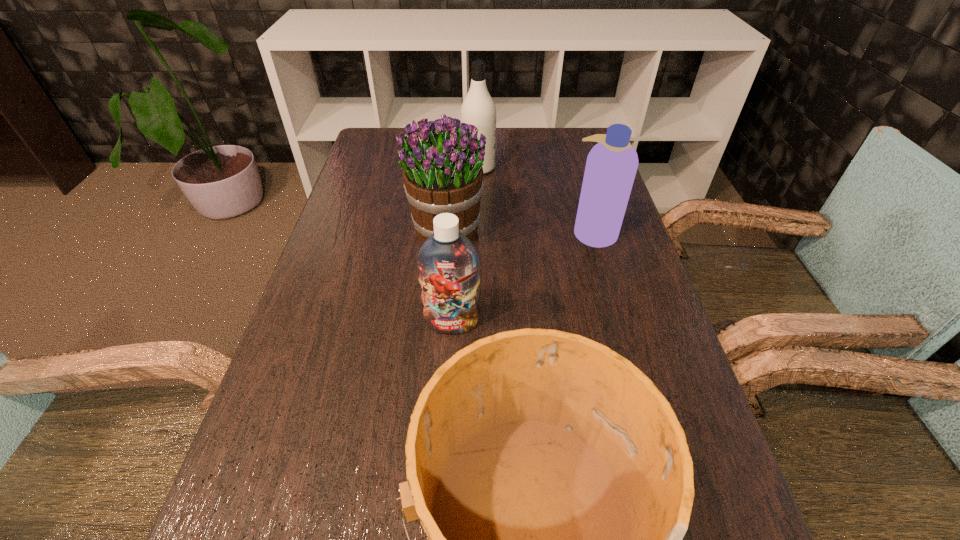
Point out which shampoo is positioned as the nearest to the bouquet. Please provide its 2D coordinates. Your answer should be formatted as a tuple, i.e. [(x, y)], where the tuple contains the x and y coordinates of a point satisfying the conditions above.

[(478, 108)]

You are a GUI agent. You are given a task and a screenshot of the screen. Output one action in this format:
    pyautogui.click(x=<x>, y=<y>)
    Task: Click on the shampoo that is the second closest to the second nearest object
    This screenshot has width=960, height=540.
    Given the screenshot: What is the action you would take?
    pyautogui.click(x=478, y=108)

Identify the location of free location that satisfies the following two spatial constraints: 1. on the front-facing side of the farthest object; 2. on the back side of the rightmost shampoo. This screenshot has height=540, width=960. (478, 232).

Identify the location of vacant space that satisfies the following two spatial constraints: 1. on the front side of the bouquet; 2. on the left side of the rightmost shampoo. (446, 232).

Where is `free spot that satisfies the following two spatial constraints: 1. on the front-facing side of the farthest shampoo; 2. on the front label of the nearest shampoo`? The width and height of the screenshot is (960, 540). free spot that satisfies the following two spatial constraints: 1. on the front-facing side of the farthest shampoo; 2. on the front label of the nearest shampoo is located at coordinates (478, 323).

Locate an element on the screen. The height and width of the screenshot is (540, 960). vacant space that satisfies the following two spatial constraints: 1. on the front-facing side of the second farthest shampoo; 2. on the left side of the farthest shampoo is located at coordinates (478, 232).